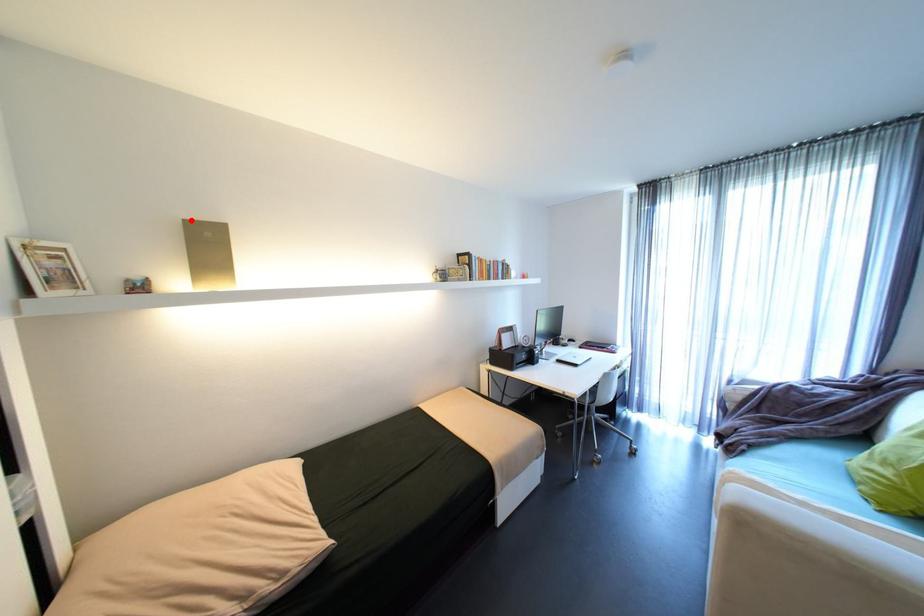
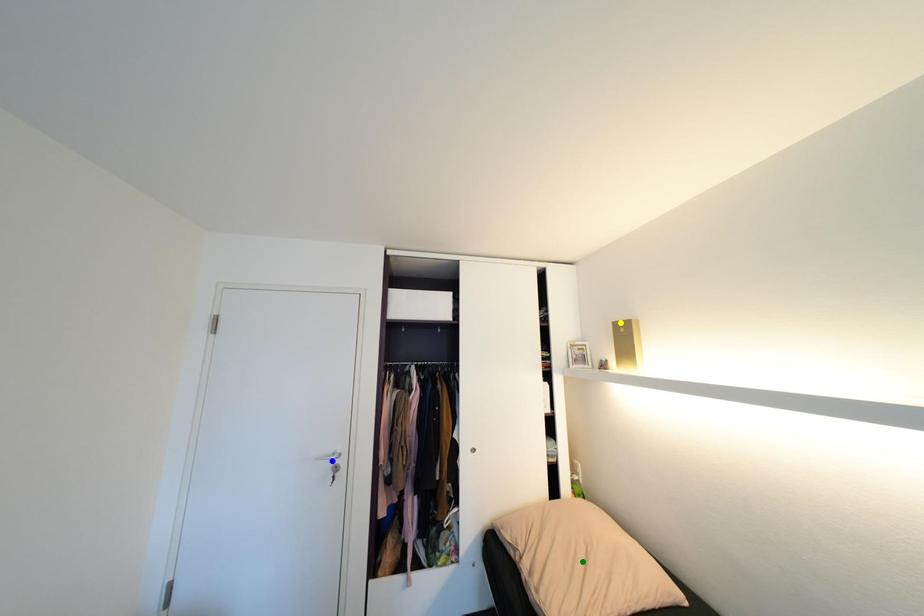
Question: I am providing you with two images of the same scene from different viewpoints. A red point is marked on the first image. You are given multiple points on the second image. In image 2, which mark is for the same physical point as the one in image 1?

Choices:
 (A) green point
 (B) blue point
 (C) yellow point

Answer: (C)